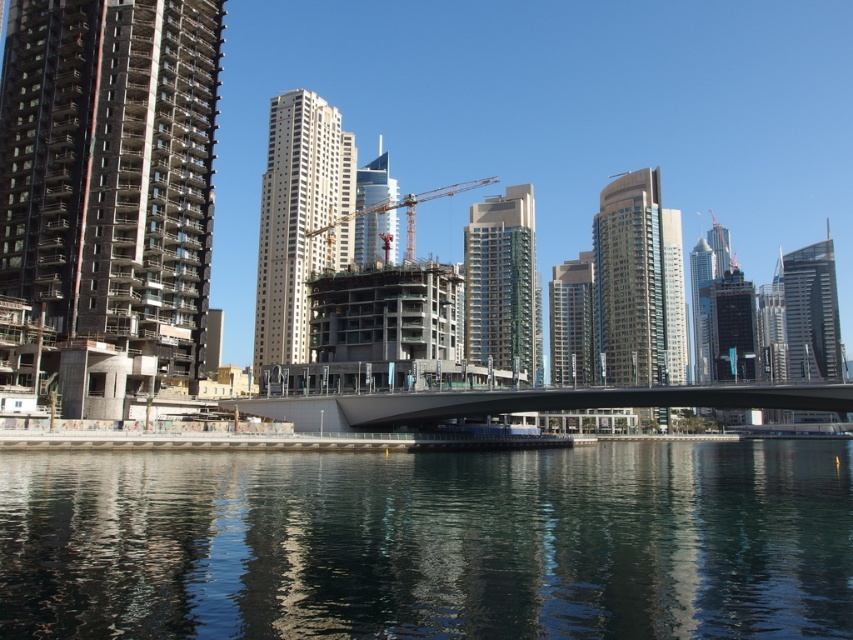
From the picture: You are a photographer planning to capture the dark reflective water at center and the white glass skyscraper at center in a single frame. Based on their sizes in the image, which object should you focus on first to ensure both are clearly visible in your composition?

The dark reflective water at center has a smaller size compared to the white glass skyscraper at center. To ensure both are clearly visible, focus on the smaller dark reflective water at center first, then adjust the composition to include the larger white glass skyscraper at center.

In the scene shown: You are a city planner evaluating the urban layout. Based on the scene, which of the two buildings, the beige glass building at center or the glassy steel skyscraper at right, would require more land area if they were to be constructed identically in another city?

The glassy steel skyscraper at right requires more land area because it occupies more space than the beige glass building at center.

You are a drone operator trying to capture a photo of the dark reflective water at center. The drone must hover exactly at the 2D coordinates provided in the scene description. What coordinates should the drone be set to?

The dark reflective water at center is located at point (430, 541), so the drone should be set to coordinates (430, 541).